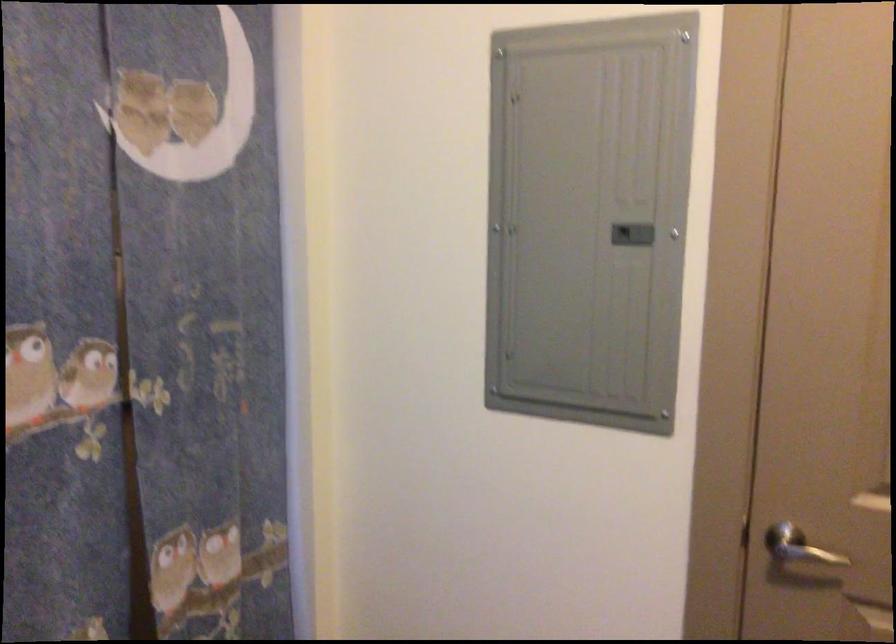
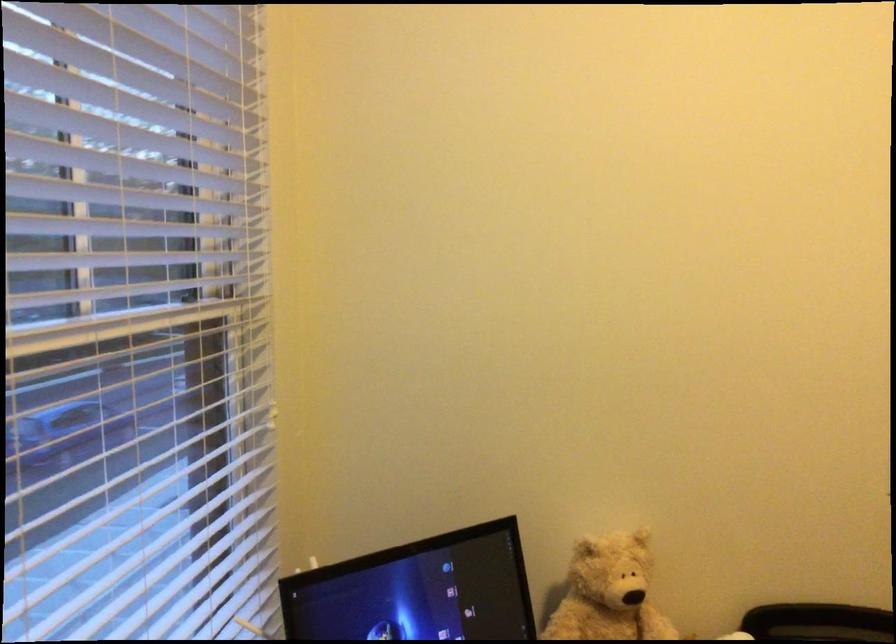
Question: The camera is either moving clockwise (left) or counter-clockwise (right) around the object. The first image is from the beginning of the video and the second image is from the end. Is the camera moving left or right when shooting the video?

Choices:
 (A) Left
 (B) Right

Answer: (B)